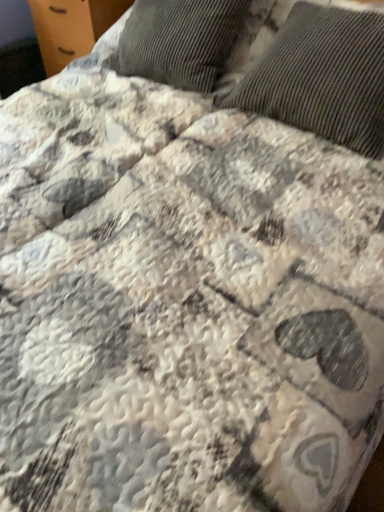
Where is `gray corduroy pillow at upper right`? This screenshot has height=512, width=384. gray corduroy pillow at upper right is located at coordinates (322, 77).

This screenshot has width=384, height=512. What do you see at coordinates (322, 77) in the screenshot?
I see `gray corduroy pillow at upper right` at bounding box center [322, 77].

Measure the distance between point (316, 60) and camera.

Point (316, 60) is 1.12 meters away from camera.

This screenshot has width=384, height=512. What are the coordinates of `gray corduroy pillow at upper right` in the screenshot? It's located at (322, 77).